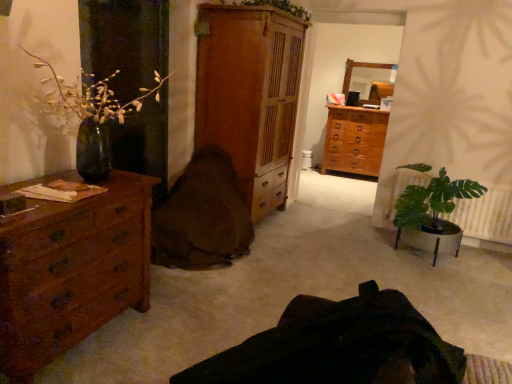
Question: Can you confirm if brown fabric swivel chair at center, which appears as the second swivel chair when viewed from the front, is wider than brown wooden chest of drawers at center, which is the third chest of drawers from front to back?

Choices:
 (A) no
 (B) yes

Answer: (B)

Question: Can you confirm if brown fabric swivel chair at center, which appears as the second swivel chair when viewed from the front, is taller than brown wooden chest of drawers at center, which appears as the 1th chest of drawers when viewed from the back?

Choices:
 (A) yes
 (B) no

Answer: (B)

Question: Can you confirm if brown fabric swivel chair at center, which appears as the second swivel chair when viewed from the front, is positioned to the right of brown wooden chest of drawers at center, which appears as the 1th chest of drawers when viewed from the back?

Choices:
 (A) yes
 (B) no

Answer: (B)

Question: Considering the relative sizes of brown fabric swivel chair at center, which appears as the second swivel chair when viewed from the front, and brown wooden chest of drawers at center, arranged as the 1th chest of drawers when viewed from the right, in the image provided, is brown fabric swivel chair at center, which appears as the second swivel chair when viewed from the front, smaller than brown wooden chest of drawers at center, arranged as the 1th chest of drawers when viewed from the right,?

Choices:
 (A) yes
 (B) no

Answer: (B)

Question: From the image's perspective, is brown fabric swivel chair at center, placed as the first swivel chair when sorted from back to front, located beneath brown wooden chest of drawers at center, which appears as the 1th chest of drawers when viewed from the back?

Choices:
 (A) no
 (B) yes

Answer: (B)

Question: Considering the relative positions of brown fabric swivel chair at center, placed as the first swivel chair when sorted from back to front, and brown wooden chest of drawers at center, which is the third chest of drawers from front to back, in the image provided, is brown fabric swivel chair at center, placed as the first swivel chair when sorted from back to front, behind brown wooden chest of drawers at center, which is the third chest of drawers from front to back,?

Choices:
 (A) no
 (B) yes

Answer: (A)

Question: Considering the relative sizes of brown wood chest of drawers at left, which is the first chest of drawers in front-to-back order, and wooden frame mirror at upper center in the image provided, is brown wood chest of drawers at left, which is the first chest of drawers in front-to-back order, bigger than wooden frame mirror at upper center?

Choices:
 (A) yes
 (B) no

Answer: (A)

Question: Can you confirm if brown wood chest of drawers at left, the third chest of drawers positioned from the right, is shorter than wooden frame mirror at upper center?

Choices:
 (A) yes
 (B) no

Answer: (B)

Question: Is brown wood chest of drawers at left, the third chest of drawers positioned from the right, outside of wooden frame mirror at upper center?

Choices:
 (A) yes
 (B) no

Answer: (A)

Question: Is brown wood chest of drawers at left, the 3th chest of drawers in the back-to-front sequence, in front of wooden frame mirror at upper center?

Choices:
 (A) yes
 (B) no

Answer: (A)

Question: Does brown wood chest of drawers at left, the first chest of drawers when ordered from left to right, appear on the right side of wooden frame mirror at upper center?

Choices:
 (A) yes
 (B) no

Answer: (B)

Question: Could you tell me if brown wood chest of drawers at left, the third chest of drawers positioned from the right, is facing wooden frame mirror at upper center?

Choices:
 (A) yes
 (B) no

Answer: (B)

Question: Is brown fabric swivel chair at center, placed as the first swivel chair when sorted from back to front, oriented away from green glossy vase at left, marked as the 1th houseplant in a left-to-right arrangement?

Choices:
 (A) yes
 (B) no

Answer: (B)